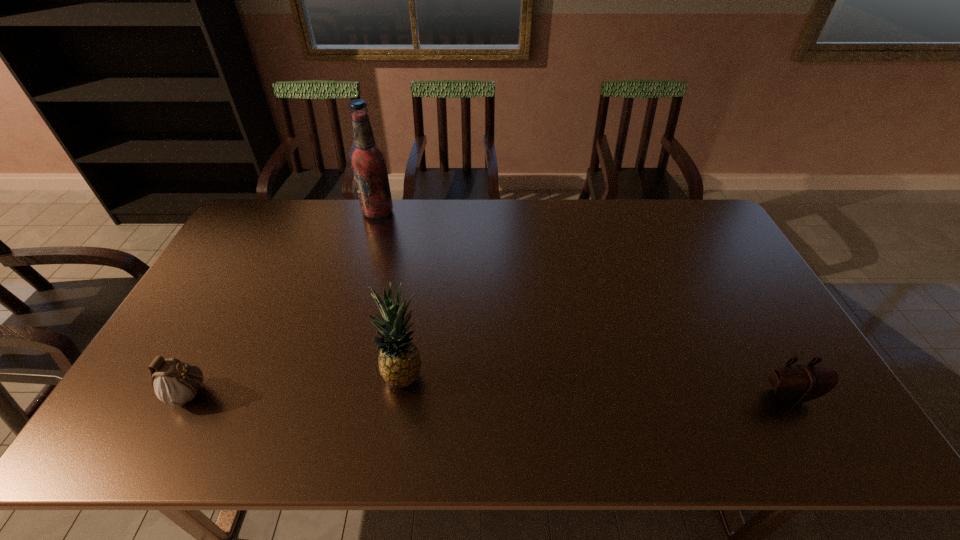
The width and height of the screenshot is (960, 540). I want to click on vacant area in the image that satisfies the following two spatial constraints: 1. on the front side of the alcohol; 2. on the left side of the second tallest object, so click(x=332, y=375).